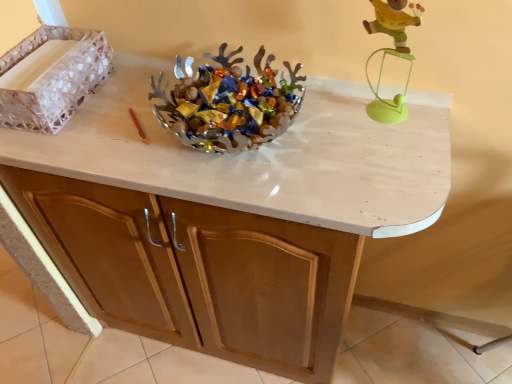
Where is `vacant area situated to the left side of wooden figure at upper right`? The width and height of the screenshot is (512, 384). vacant area situated to the left side of wooden figure at upper right is located at coordinates (326, 124).